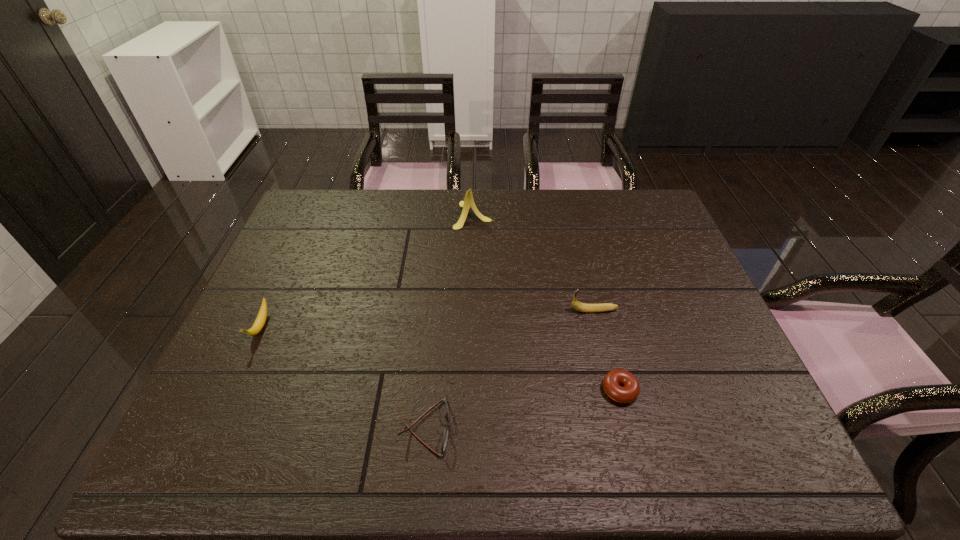
At what (x,y) coordinates should I click in order to perform the action: click on free space that is in between the second banana from right to left and the spectacles. Please return your answer as a coordinate pair (x, y). Looking at the image, I should click on (448, 321).

Where is `empty space that is in between the doughnut and the spectacles`? The image size is (960, 540). empty space that is in between the doughnut and the spectacles is located at coordinates (521, 409).

Locate an element on the screen. The height and width of the screenshot is (540, 960). vacant area between the rightmost banana and the farthest banana is located at coordinates (534, 262).

At what (x,y) coordinates should I click in order to perform the action: click on object that stands as the fourth closest to the rightmost banana. Please return your answer as a coordinate pair (x, y). This screenshot has height=540, width=960. Looking at the image, I should click on (262, 315).

In order to click on the closest object to the doughnut in this screenshot , I will do `click(582, 307)`.

Select which banana is the second closest to the second tallest object. Please provide its 2D coordinates. Your answer should be formatted as a tuple, i.e. [(x, y)], where the tuple contains the x and y coordinates of a point satisfying the conditions above.

[(262, 315)]

Where is `banana that is the second closest one to the spectacles`? This screenshot has height=540, width=960. banana that is the second closest one to the spectacles is located at coordinates (262, 315).

What are the coordinates of `free location that satisfies the following two spatial constraints: 1. at the stem of the rightmost banana; 2. at the stem of the third tallest object` in the screenshot? It's located at (598, 327).

Find the location of a particular element. The width and height of the screenshot is (960, 540). vacant space that satisfies the following two spatial constraints: 1. at the stem of the second shortest banana; 2. at the stem of the third tallest object is located at coordinates (598, 327).

Find the location of a particular element. The image size is (960, 540). free spot that satisfies the following two spatial constraints: 1. on the front side of the second banana from left to right; 2. on the front-facing side of the spectacles is located at coordinates (470, 427).